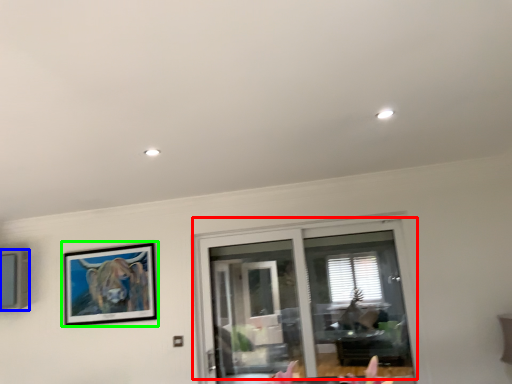
Question: Which is nearer to the window (highlighted by a red box)? picture frame (highlighted by a blue box) or picture frame (highlighted by a green box).

Choices:
 (A) picture frame
 (B) picture frame

Answer: (B)